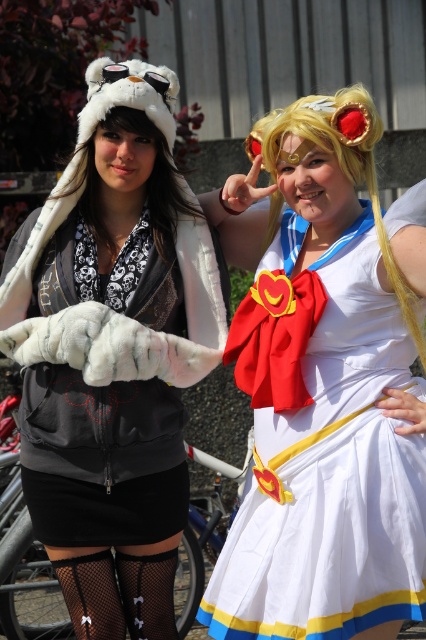
Is white satin dress at center to the right of blonde hair at center from the viewer's perspective?

Incorrect, white satin dress at center is not on the right side of blonde hair at center.

Is white satin dress at center positioned behind blonde hair at center?

No, white satin dress at center is closer to the viewer.

Is point (334, 506) behind point (268, 129)?

That is False.

I want to click on white satin dress at center, so click(x=331, y=477).

Does white fur hat at upper left have a lesser width compared to white satin dress at center?

No.

Does white fur hat at upper left appear on the left side of white satin dress at center?

Indeed, white fur hat at upper left is positioned on the left side of white satin dress at center.

Identify the location of white fur hat at upper left. The width and height of the screenshot is (426, 640). (112, 353).

Does white fur hat at upper left have a lesser height compared to blonde hair at center?

Incorrect, white fur hat at upper left's height does not fall short of blonde hair at center's.

This screenshot has height=640, width=426. What are the coordinates of `white fur hat at upper left` in the screenshot? It's located at (112, 353).

Between point (118, 204) and point (402, 292), which one is positioned behind?

The point (118, 204) is behind.

The height and width of the screenshot is (640, 426). What are the coordinates of `white fur hat at upper left` in the screenshot? It's located at (112, 353).